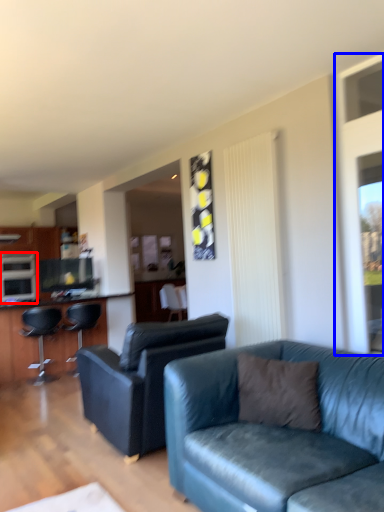
Question: Which object is closer to the camera taking this photo, appliance (highlighted by a red box) or window screen (highlighted by a blue box)?

Choices:
 (A) appliance
 (B) window screen

Answer: (B)